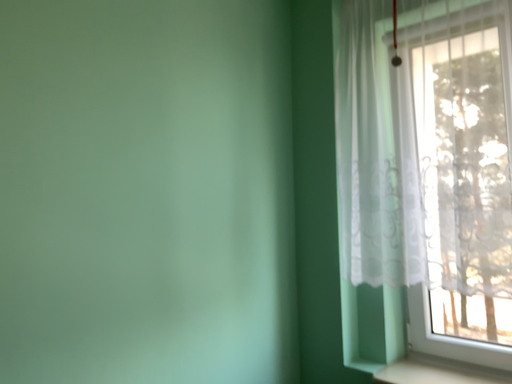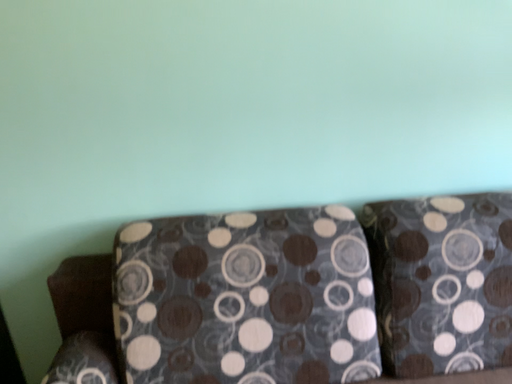
Question: How did the camera likely rotate when shooting the video?

Choices:
 (A) rotated right
 (B) rotated left

Answer: (B)